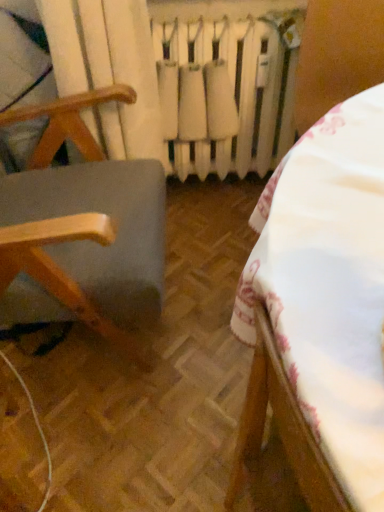
Where is `white matte radiator at center`? The image size is (384, 512). white matte radiator at center is located at coordinates (226, 83).

Measure the distance between wooden chair at left, acting as the 2th furniture starting from the right, and camera.

30.62 inches.

Identify the location of white matte radiator at center. (226, 83).

From a real-world perspective, is white matte radiator at center physically above white fabric tablecloth at center, the first furniture viewed from the right?

No, from a real-world perspective, white matte radiator at center is not above white fabric tablecloth at center, the first furniture viewed from the right.

Is white matte radiator at center spatially inside white fabric tablecloth at center, the second furniture viewed from the left, or outside of it?

white matte radiator at center is not enclosed by white fabric tablecloth at center, the second furniture viewed from the left.

Is white matte radiator at center far away from white fabric tablecloth at center, the first furniture viewed from the right?

That's not correct — white matte radiator at center is a little close to white fabric tablecloth at center, the first furniture viewed from the right.

Can you confirm if white matte radiator at center is positioned to the left of white fabric tablecloth at center, the second furniture viewed from the left?

Yes.

Considering the relative sizes of white matte radiator at center and wooden chair at left, acting as the 2th furniture starting from the right, in the image provided, is white matte radiator at center taller than wooden chair at left, acting as the 2th furniture starting from the right,?

Incorrect, the height of white matte radiator at center is not larger of that of wooden chair at left, acting as the 2th furniture starting from the right.

In the image, is white matte radiator at center on the left side or the right side of wooden chair at left, positioned as the first furniture in left-to-right order?

Based on their positions, white matte radiator at center is located to the right of wooden chair at left, positioned as the first furniture in left-to-right order.

Considering the relative sizes of white matte radiator at center and wooden chair at left, acting as the 2th furniture starting from the right, in the image provided, is white matte radiator at center thinner than wooden chair at left, acting as the 2th furniture starting from the right,?

Yes, white matte radiator at center is thinner than wooden chair at left, acting as the 2th furniture starting from the right.

From the image's perspective, is white matte radiator at center below wooden chair at left, positioned as the first furniture in left-to-right order?

Actually, white matte radiator at center appears above wooden chair at left, positioned as the first furniture in left-to-right order, in the image.

Which is in front, white fabric tablecloth at center, the first furniture viewed from the right, or white matte radiator at center?

white fabric tablecloth at center, the first furniture viewed from the right, is more forward.

Which point is more distant from viewer, (301,145) or (167,90)?

Positioned behind is point (167,90).

Considering the sizes of objects white fabric tablecloth at center, the second furniture viewed from the left, and white matte radiator at center in the image provided, who is wider, white fabric tablecloth at center, the second furniture viewed from the left, or white matte radiator at center?

With larger width is white fabric tablecloth at center, the second furniture viewed from the left.

Consider the image. From the image's perspective, is white fabric tablecloth at center, the first furniture viewed from the right, below white matte radiator at center?

Yes, from the image's perspective, white fabric tablecloth at center, the first furniture viewed from the right, is beneath white matte radiator at center.

Which of these two, white fabric tablecloth at center, the second furniture viewed from the left, or wooden chair at left, positioned as the first furniture in left-to-right order, is wider?

With larger width is white fabric tablecloth at center, the second furniture viewed from the left.

From the image's perspective, is white fabric tablecloth at center, the first furniture viewed from the right, above or below wooden chair at left, acting as the 2th furniture starting from the right?

Based on their image positions, white fabric tablecloth at center, the first furniture viewed from the right, is located beneath wooden chair at left, acting as the 2th furniture starting from the right.

From a real-world perspective, who is located higher, white fabric tablecloth at center, the second furniture viewed from the left, or wooden chair at left, positioned as the first furniture in left-to-right order?

wooden chair at left, positioned as the first furniture in left-to-right order.

From the image's perspective, is wooden chair at left, acting as the 2th furniture starting from the right, positioned above or below white fabric tablecloth at center, the second furniture viewed from the left?

wooden chair at left, acting as the 2th furniture starting from the right, is situated higher than white fabric tablecloth at center, the second furniture viewed from the left, in the image.

Considering the positions of objects wooden chair at left, acting as the 2th furniture starting from the right, and white fabric tablecloth at center, the first furniture viewed from the right, in the image provided, who is more to the right, wooden chair at left, acting as the 2th furniture starting from the right, or white fabric tablecloth at center, the first furniture viewed from the right,?

white fabric tablecloth at center, the first furniture viewed from the right.

Can you confirm if wooden chair at left, positioned as the first furniture in left-to-right order, is wider than white fabric tablecloth at center, the second furniture viewed from the left?

In fact, wooden chair at left, positioned as the first furniture in left-to-right order, might be narrower than white fabric tablecloth at center, the second furniture viewed from the left.

Which is more distant, (51,260) or (226,502)?

Point (51,260)

From the picture: From a real-world perspective, between wooden chair at left, positioned as the first furniture in left-to-right order, and white matte radiator at center, who is vertically higher?

wooden chair at left, positioned as the first furniture in left-to-right order.

Considering the positions of objects wooden chair at left, acting as the 2th furniture starting from the right, and white matte radiator at center in the image provided, who is more to the left, wooden chair at left, acting as the 2th furniture starting from the right, or white matte radiator at center?

wooden chair at left, acting as the 2th furniture starting from the right, is more to the left.

In terms of width, does wooden chair at left, positioned as the first furniture in left-to-right order, look wider or thinner when compared to white matte radiator at center?

Clearly, wooden chair at left, positioned as the first furniture in left-to-right order, has more width compared to white matte radiator at center.

Which object is closer to the camera, wooden chair at left, acting as the 2th furniture starting from the right, or white matte radiator at center?

wooden chair at left, acting as the 2th furniture starting from the right, is in front.

Locate an element on the screen. This screenshot has height=512, width=384. radiator lying above the white fabric tablecloth at center, the second furniture viewed from the left (from the image's perspective) is located at coordinates (226, 83).

The width and height of the screenshot is (384, 512). Find the location of `radiator that is behind the wooden chair at left, acting as the 2th furniture starting from the right`. radiator that is behind the wooden chair at left, acting as the 2th furniture starting from the right is located at coordinates (226, 83).

Estimate the real-world distances between objects in this image. Which object is further from white matte radiator at center, white fabric tablecloth at center, the second furniture viewed from the left, or wooden chair at left, acting as the 2th furniture starting from the right?

white fabric tablecloth at center, the second furniture viewed from the left, lies further to white matte radiator at center than the other object.

Looking at the image, which one is located further to white matte radiator at center, wooden chair at left, positioned as the first furniture in left-to-right order, or white fabric tablecloth at center, the first furniture viewed from the right?

white fabric tablecloth at center, the first furniture viewed from the right.

From the image, which object appears to be farther from wooden chair at left, acting as the 2th furniture starting from the right, white fabric tablecloth at center, the first furniture viewed from the right, or white matte radiator at center?

white fabric tablecloth at center, the first furniture viewed from the right, is positioned further to the anchor wooden chair at left, acting as the 2th furniture starting from the right.

In the scene shown: Looking at the image, which one is located closer to white fabric tablecloth at center, the second furniture viewed from the left, wooden chair at left, positioned as the first furniture in left-to-right order, or white matte radiator at center?

The object closer to white fabric tablecloth at center, the second furniture viewed from the left, is wooden chair at left, positioned as the first furniture in left-to-right order.

Estimate the real-world distances between objects in this image. Which object is closer to wooden chair at left, positioned as the first furniture in left-to-right order, white matte radiator at center or white fabric tablecloth at center, the first furniture viewed from the right?

Among the two, white matte radiator at center is located nearer to wooden chair at left, positioned as the first furniture in left-to-right order.

Based on their spatial positions, is white matte radiator at center or wooden chair at left, acting as the 2th furniture starting from the right, further from white fabric tablecloth at center, the first furniture viewed from the right?

white matte radiator at center is positioned further to the anchor white fabric tablecloth at center, the first furniture viewed from the right.

Identify the location of furniture between white fabric tablecloth at center, the second furniture viewed from the left, and white matte radiator at center from front to back. This screenshot has height=512, width=384. (80, 212).